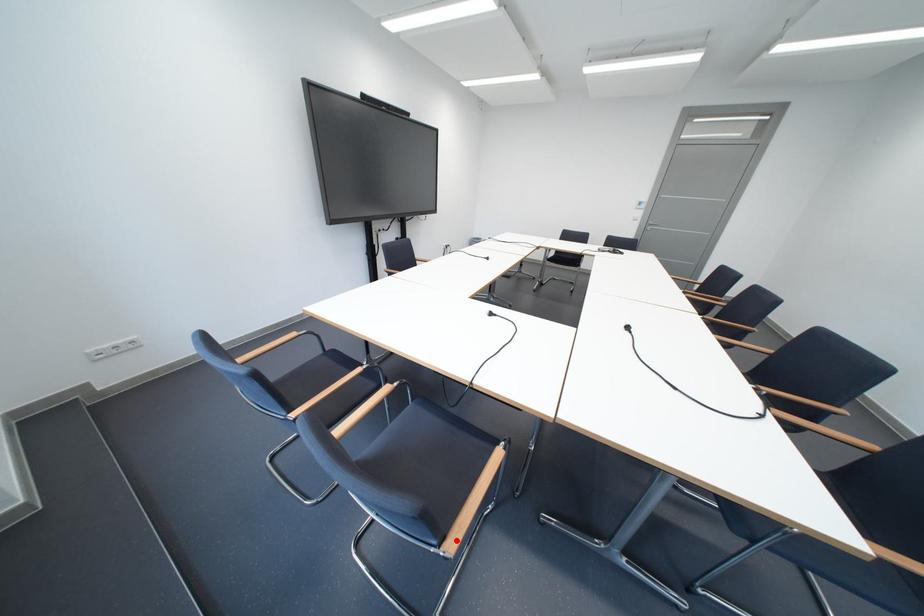
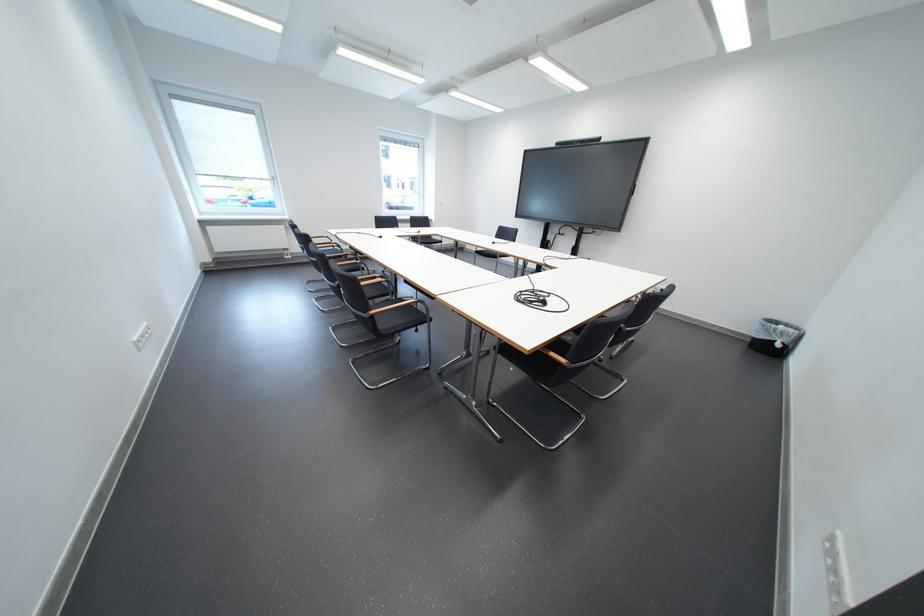
Question: I am providing you with two images of the same scene from different viewpoints. A red point is marked on the first image. Can you still see the location of the red point in image 2?

Choices:
 (A) Yes
 (B) No

Answer: (B)